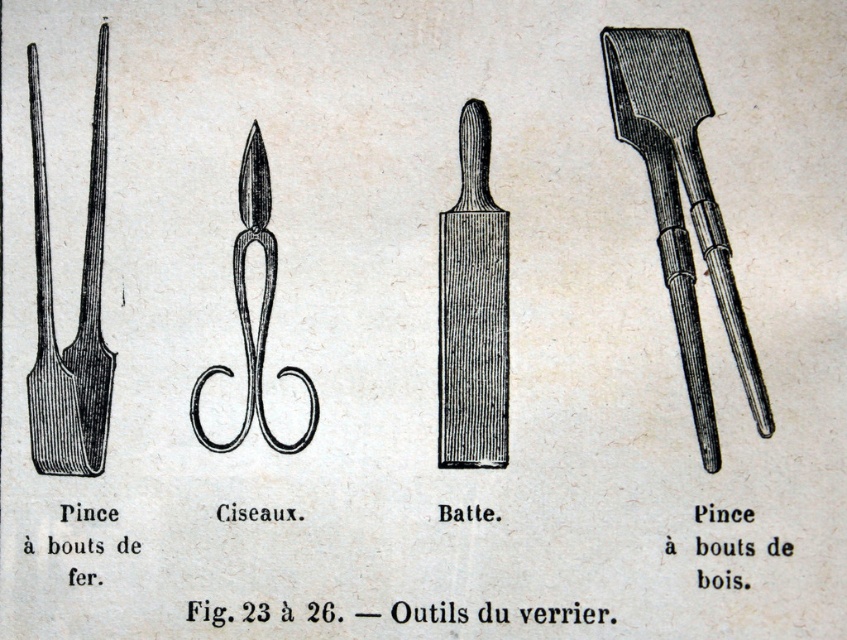
Question: Estimate the real-world distances between objects in this image. Which object is farther from the matte black tongs at left?

Choices:
 (A) wooden tongs at right
 (B) wooden bat at center

Answer: (A)

Question: Based on their relative distances, which object is farther from the matte black tongs at left?

Choices:
 (A) black wood scissors at center
 (B) wooden tongs at right

Answer: (B)

Question: Among these objects, which one is nearest to the camera?

Choices:
 (A) black wood scissors at center
 (B) matte black tongs at left
 (C) wooden tongs at right
 (D) wooden bat at center

Answer: (C)

Question: Is matte black tongs at left above black wood scissors at center?

Choices:
 (A) no
 (B) yes

Answer: (B)

Question: Considering the relative positions of wooden tongs at right and black wood scissors at center in the image provided, where is wooden tongs at right located with respect to black wood scissors at center?

Choices:
 (A) below
 (B) above

Answer: (B)

Question: In this image, where is wooden tongs at right located relative to wooden bat at center?

Choices:
 (A) left
 (B) right

Answer: (B)